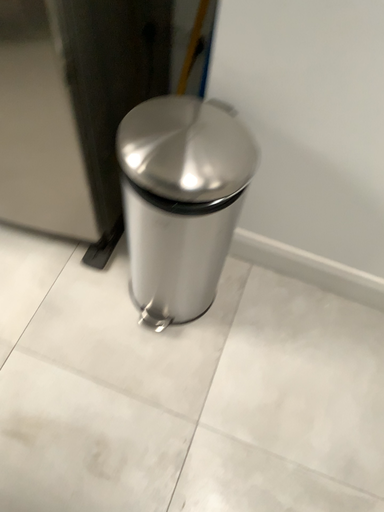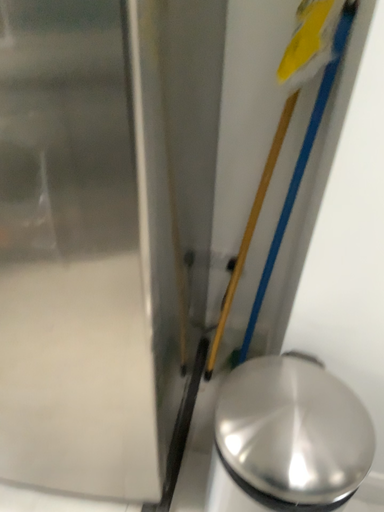
Question: Which way did the camera rotate in the video?

Choices:
 (A) rotated downward
 (B) rotated upward

Answer: (B)